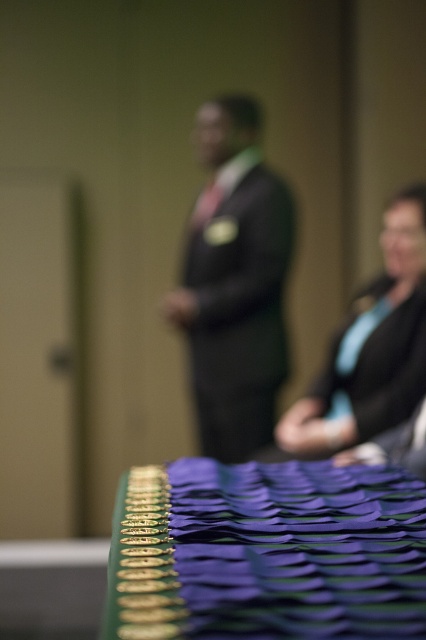
You are a photographer at the event and want to capture a clear shot of the green fabric table at lower center and the matte black sweater at right. Which object should you focus on to ensure both are in focus?

The green fabric table at lower center is located below the matte black sweater at right. To ensure both are in focus, focus on the matte black sweater at right since it is closer to the camera, and the depth of field will likely include the table below it.

Consider the image. You are attending an award ceremony and notice a specific point marked at coordinates point [305,616]. You have a small gift box that measures 16 inches in length. Can you determine if the gift box will fit horizontally from that point without overlapping any objects?

The point [305,616] is 15.53 inches away from the viewer. Since the gift box is 16 inches long, it would exceed the available space and likely overlap with nearby objects.